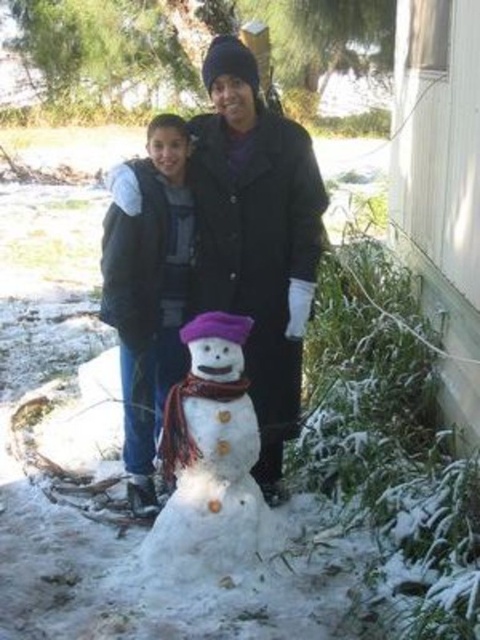
Who is more forward, (276, 339) or (167, 291)?

Positioned in front is point (167, 291).

Is white matte snowman at center taller than matte black coat at center?

Yes, white matte snowman at center is taller than matte black coat at center.

You are a GUI agent. You are given a task and a screenshot of the screen. Output one action in this format:
    pyautogui.click(x=<x>, y=<y>)
    Task: Click on the white matte snowman at center
    The width and height of the screenshot is (480, 640).
    Given the screenshot: What is the action you would take?
    pyautogui.click(x=256, y=237)

Does white matte snowman at center have a smaller size compared to white fluffy snowman at center?

Actually, white matte snowman at center might be larger than white fluffy snowman at center.

Is white matte snowman at center to the left of white fluffy snowman at center from the viewer's perspective?

In fact, white matte snowman at center is to the right of white fluffy snowman at center.

Find the location of a particular element. white matte snowman at center is located at coordinates (256, 237).

Does matte black coat at center appear on the left side of white fluffy snowman at center?

Indeed, matte black coat at center is positioned on the left side of white fluffy snowman at center.

Is matte black coat at center above white fluffy snowman at center?

Yes, matte black coat at center is above white fluffy snowman at center.

Image resolution: width=480 pixels, height=640 pixels. Describe the element at coordinates (147, 289) in the screenshot. I see `matte black coat at center` at that location.

Where is `matte black coat at center`? This screenshot has width=480, height=640. matte black coat at center is located at coordinates click(x=147, y=289).